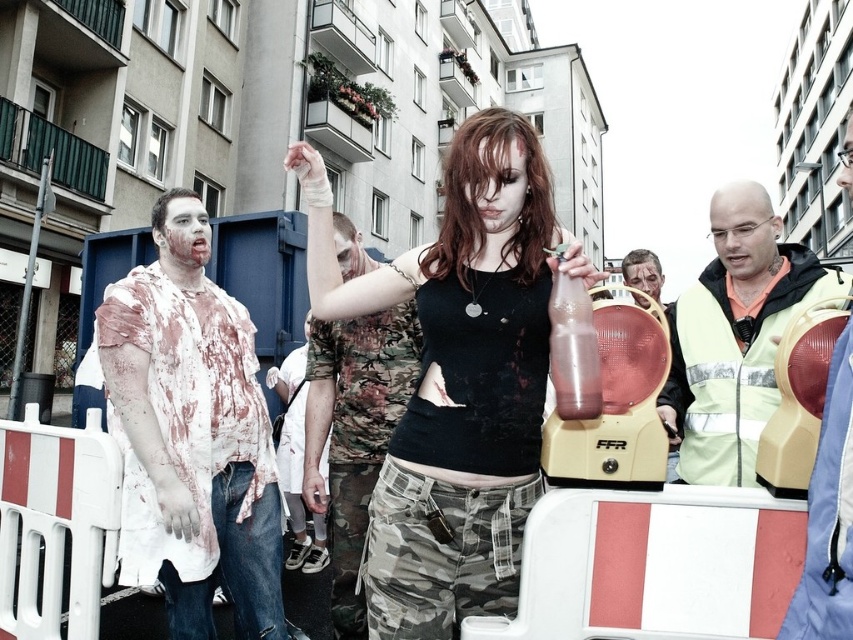
Looking at this image, you are a photographer at this zombie event. You want to take a photo focusing on the matte black tank top at center and the light green reflective vest at center right. Which one will appear larger in the photo?

The matte black tank top at center will appear larger in the photo because it is closer to the viewer than the light green reflective vest at center right.

You are a photographer at the zombie event and want to capture a shot of the matte black tank top at center and the translucent plastic bottle at center. Which object should you focus on first if you need to frame them from left to right?

The matte black tank top at center should be framed first on the left side since it is positioned to the left of the translucent plastic bottle at center.

You are a photographer at the zombie event. You need to place a spotlight on the matte black tank top at center. The spotlight can only be placed at point (x=457, y=378). Is the spotlight correctly positioned?

Yes, the matte black tank top at center is located at point (x=457, y=378), so the spotlight is correctly positioned there.